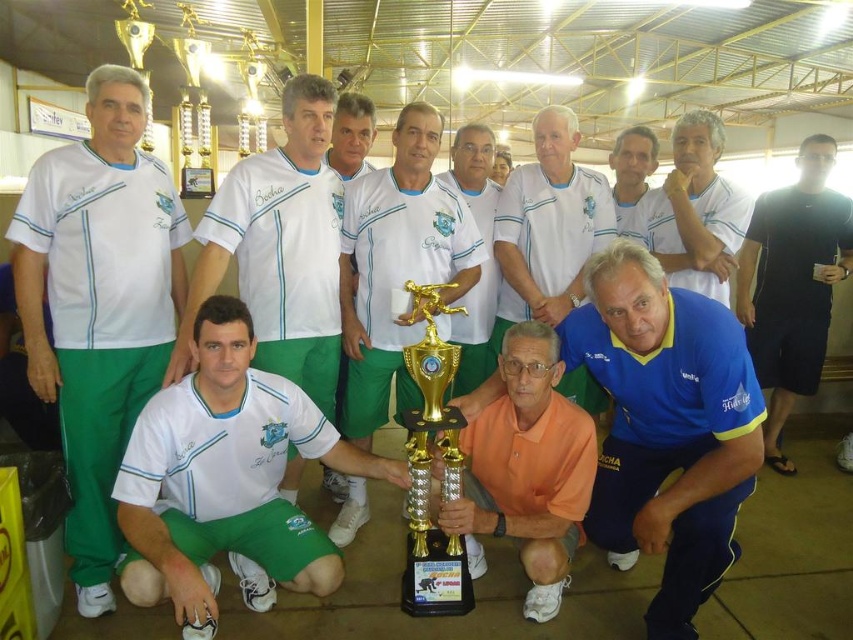
Who is more forward, (68, 272) or (817, 243)?

Point (68, 272)

Can you confirm if white matte shirt at left is positioned to the right of black fabric shirt at right?

No, white matte shirt at left is not to the right of black fabric shirt at right.

Describe the element at coordinates (99, 305) in the screenshot. The width and height of the screenshot is (853, 640). I see `white matte shirt at left` at that location.

Locate an element on the screen. Image resolution: width=853 pixels, height=640 pixels. white matte shirt at left is located at coordinates (99, 305).

Does point (637, 326) lie in front of point (682, 234)?

Yes, it is.

What do you see at coordinates (666, 426) in the screenshot? The image size is (853, 640). I see `blue jersey at center` at bounding box center [666, 426].

Identify the location of blue jersey at center. (666, 426).

Is point (749, 397) less distant than point (525, 328)?

Yes.

Locate an element on the screen. Image resolution: width=853 pixels, height=640 pixels. blue jersey at center is located at coordinates (666, 426).

At what (x,y) coordinates should I click in order to perform the action: click on blue jersey at center. Please return your answer as a coordinate pair (x, y). Image resolution: width=853 pixels, height=640 pixels. Looking at the image, I should click on (666, 426).